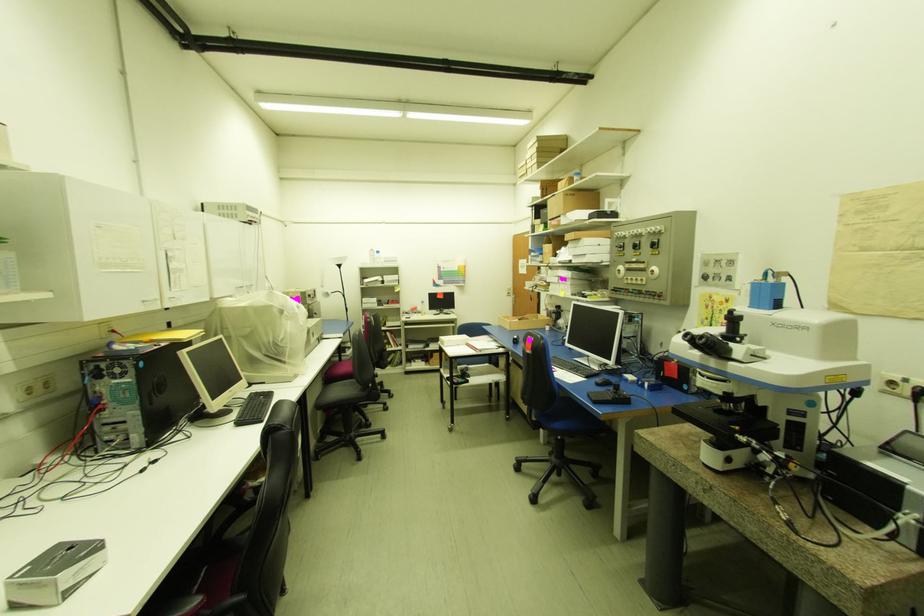
This screenshot has width=924, height=616. What do you see at coordinates (687, 337) in the screenshot?
I see `the microscope eyepieces` at bounding box center [687, 337].